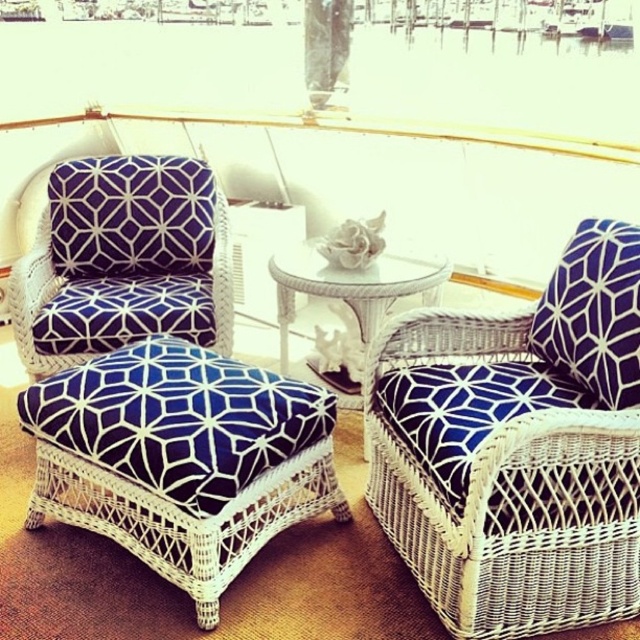
Describe the element at coordinates (593, 312) in the screenshot. I see `blue printed cushion at right` at that location.

This screenshot has height=640, width=640. I want to click on blue printed cushion at right, so click(593, 312).

At what (x,y) coordinates should I click in order to perform the action: click on blue printed cushion at right. Please return your answer as a coordinate pair (x, y). The image size is (640, 640). Looking at the image, I should click on (593, 312).

Does white wicker armchair at center appear under blue printed cushion at right?

Yes.

Is point (424, 589) positioned before point (600, 317)?

Yes, point (424, 589) is closer to viewer.

Does point (602, 403) come in front of point (582, 269)?

Yes, it is.

Find the location of a particular element. white wicker armchair at center is located at coordinates (516, 449).

Where is `navy blue fabric stool at center`? This screenshot has width=640, height=640. navy blue fabric stool at center is located at coordinates (180, 458).

Consider the image. Is navy blue fabric stool at center bigger than matte blue fabric armchair at left?

Indeed, navy blue fabric stool at center has a larger size compared to matte blue fabric armchair at left.

Does point (122, 449) come in front of point (17, 275)?

Yes, it is in front of point (17, 275).

At what (x,y) coordinates should I click in order to perform the action: click on navy blue fabric stool at center. Please return your answer as a coordinate pair (x, y). This screenshot has height=640, width=640. Looking at the image, I should click on (180, 458).